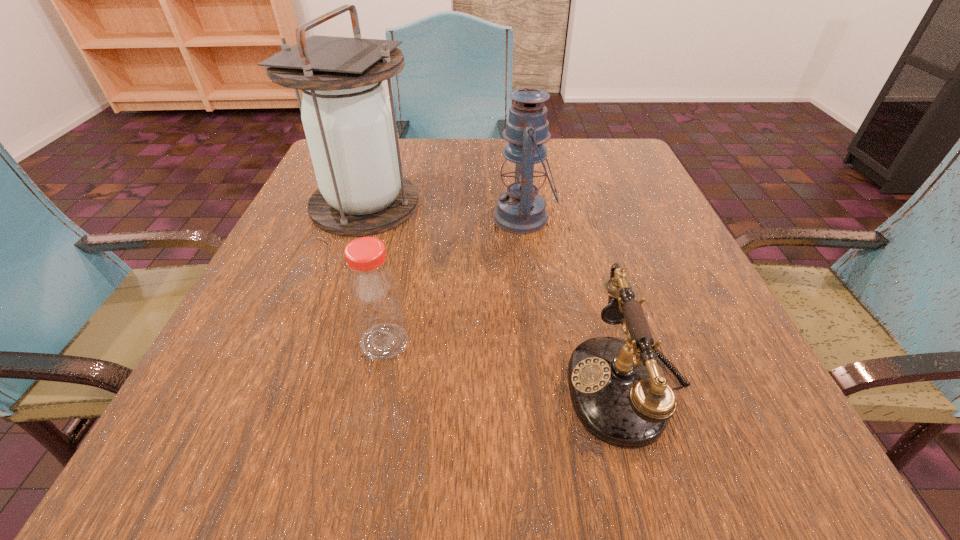
Find the location of a particular element. vacant space at the far edge of the desktop is located at coordinates (559, 139).

Locate an element on the screen. Image resolution: width=960 pixels, height=540 pixels. free space at the near edge of the desktop is located at coordinates (x=661, y=483).

In the image, there is a desktop. In order to click on vacant space at the left edge in this screenshot , I will do `click(303, 214)`.

Locate an element on the screen. free spot at the right edge of the desktop is located at coordinates (599, 192).

The height and width of the screenshot is (540, 960). I want to click on free spot at the near right corner of the desktop, so click(752, 457).

Find the location of `free space between the bottle and the shortest object`. free space between the bottle and the shortest object is located at coordinates (506, 363).

Identify the location of free space between the telephone and the taller lantern. This screenshot has height=540, width=960. [x=496, y=294].

Locate an element on the screen. This screenshot has width=960, height=540. vacant area between the left lantern and the telephone is located at coordinates (496, 294).

Identify the location of blank region between the third tallest object and the shorter lantern. Image resolution: width=960 pixels, height=540 pixels. (454, 280).

Locate an element on the screen. vacant space that's between the shortest object and the right lantern is located at coordinates (575, 301).